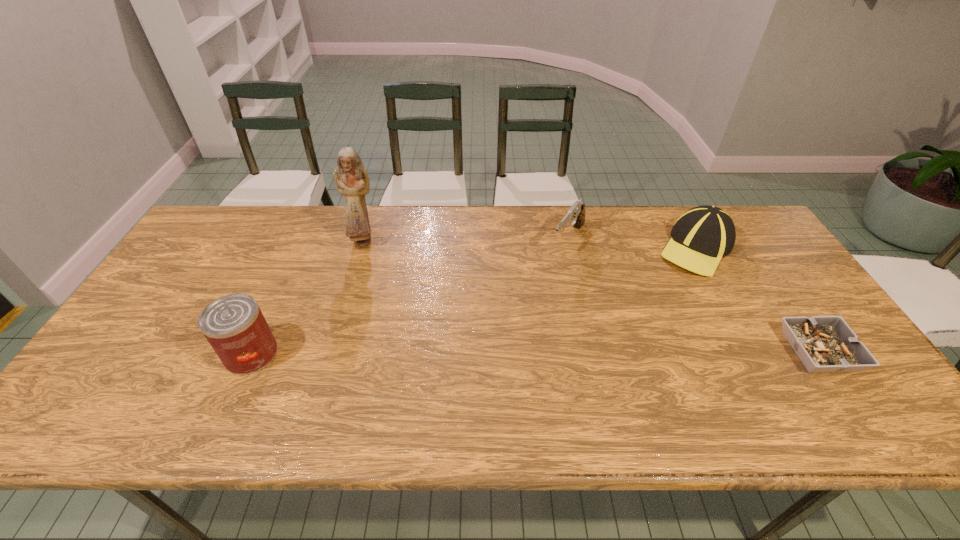
Identify the location of can that is at the near edge. (234, 325).

Where is `ashtray at the near edge`? This screenshot has width=960, height=540. ashtray at the near edge is located at coordinates (824, 344).

The image size is (960, 540). Identify the location of ashtray positioned at the right edge. (824, 344).

This screenshot has width=960, height=540. Identify the location of baseball cap that is at the right edge. (703, 235).

Locate an element on the screen. The image size is (960, 540). object located at the far right corner is located at coordinates [x=703, y=235].

What are the coordinates of `object that is positioned at the near right corner` in the screenshot? It's located at (824, 344).

In the image, there is a desktop. Identify the location of free space at the far edge. Image resolution: width=960 pixels, height=540 pixels. (442, 232).

At what (x,y) coordinates should I click in order to perform the action: click on free region at the left edge. Please return your answer as a coordinate pair (x, y). Looking at the image, I should click on (140, 355).

What are the coordinates of `free region at the right edge of the desktop` in the screenshot? It's located at (787, 342).

I want to click on vacant space at the far left corner of the desktop, so (x=246, y=206).